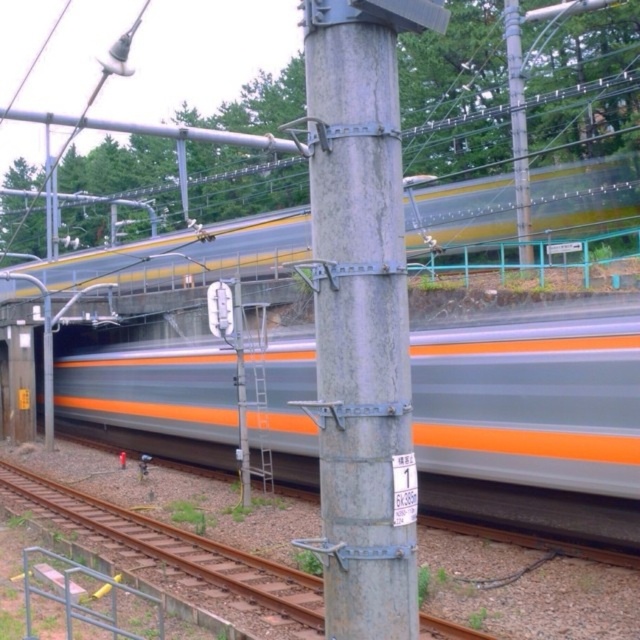
Question: Does gray metallic pole at center have a lesser width compared to metallic gray telegraph pole at upper center?

Choices:
 (A) yes
 (B) no

Answer: (A)

Question: Among these points, which one is nearest to the camera?

Choices:
 (A) (323, 86)
 (B) (522, 113)
 (C) (636, 440)

Answer: (A)

Question: Considering the relative positions of silver metallic train at center and gray metallic pole at center in the image provided, where is silver metallic train at center located with respect to gray metallic pole at center?

Choices:
 (A) right
 (B) left

Answer: (B)

Question: Observing the image, what is the correct spatial positioning of silver metallic train at center in reference to metallic gray telegraph pole at upper center?

Choices:
 (A) left
 (B) right

Answer: (A)

Question: Among these points, which one is farthest from the camera?

Choices:
 (A) (522, 262)
 (B) (323, 436)

Answer: (A)

Question: Which point appears closest to the camera in this image?

Choices:
 (A) (134, 384)
 (B) (342, 628)
 (C) (524, 106)

Answer: (B)